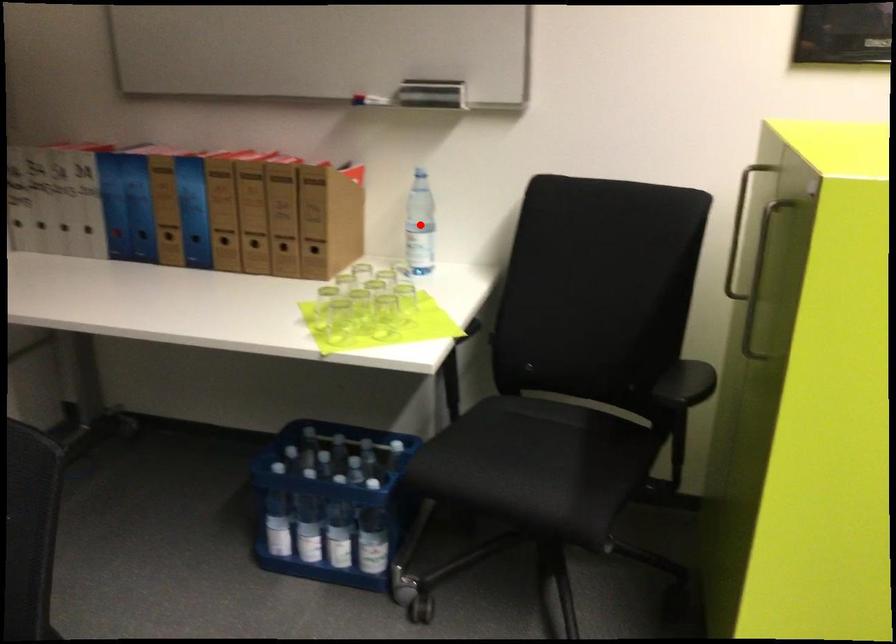
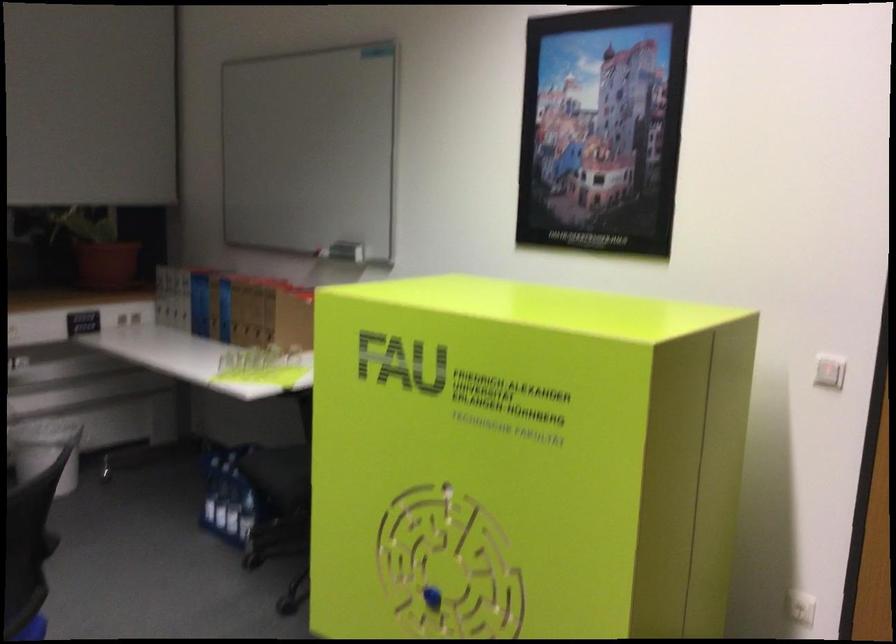
Question: I am providing you with two images of the same scene from different viewpoints. A red point is marked on the first image. At the location where the point appears in image 1, is it still visible in image 2?

Choices:
 (A) Yes
 (B) No

Answer: (B)